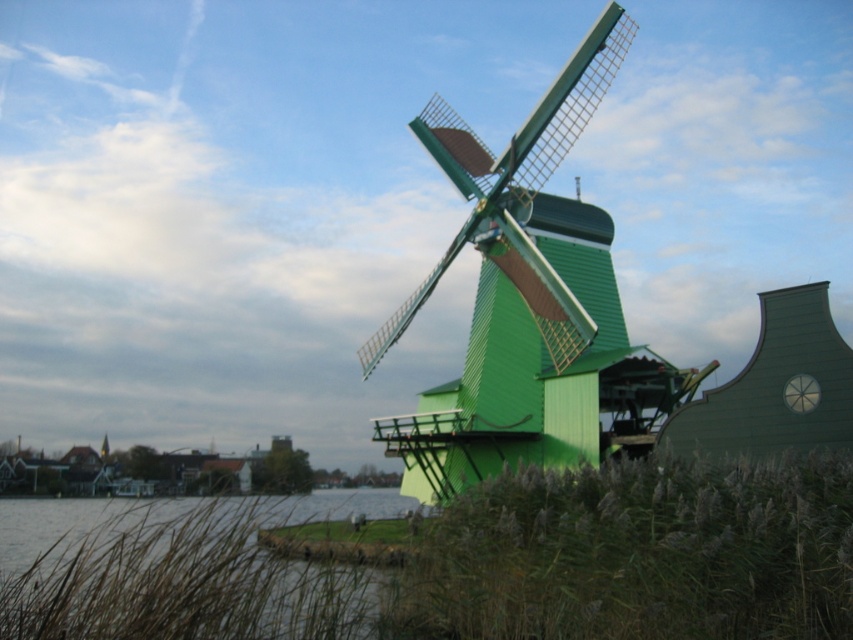
Question: Is green grass at lower right bigger than clear water at lower left?

Choices:
 (A) no
 (B) yes

Answer: (A)

Question: Which point is closer to the camera?

Choices:
 (A) green wooden windmill at center
 (B) clear water at lower left
 (C) green grass at lower right

Answer: (B)

Question: Can you confirm if green grass at lower right is bigger than green wooden windmill at center?

Choices:
 (A) yes
 (B) no

Answer: (B)

Question: Which point appears farthest from the camera in this image?

Choices:
 (A) (445, 419)
 (B) (265, 500)
 (C) (512, 541)

Answer: (A)

Question: Does green grass at lower right lie behind green wooden windmill at center?

Choices:
 (A) no
 (B) yes

Answer: (A)

Question: Among these objects, which one is nearest to the camera?

Choices:
 (A) clear water at lower left
 (B) green grass at lower right
 (C) green wooden windmill at center

Answer: (A)